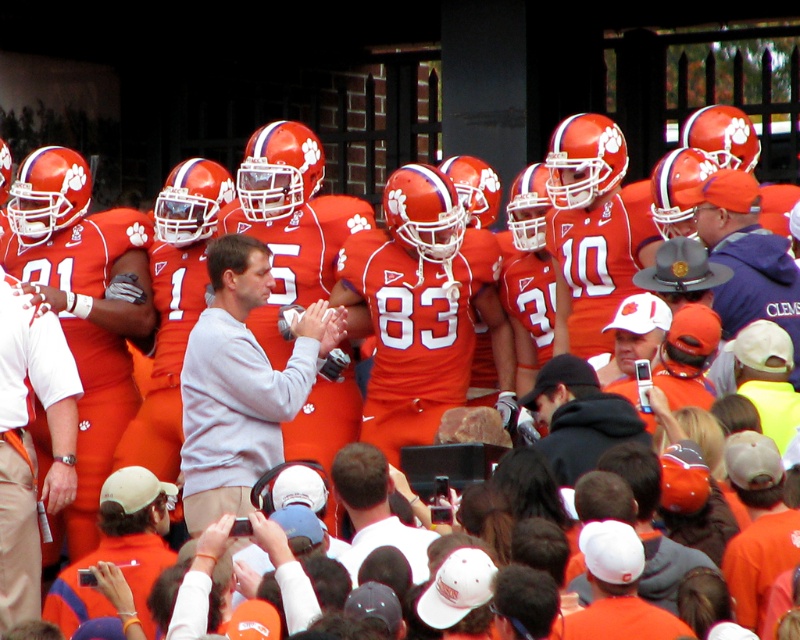
Between point (230, 378) and point (570, 376), which one is positioned behind?

The point (230, 378) is more distant.

Measure the distance between point (238, 468) and camera.

Point (238, 468) and camera are 59.45 meters apart.

At what (x,y) coordinates should I click in order to perform the action: click on gray sweatshirt at center. Please return your answer as a coordinate pair (x, y). Looking at the image, I should click on (x=241, y=381).

Can you confirm if orange jersey at lower left is positioned above white matte cap at center?

Incorrect, orange jersey at lower left is not positioned above white matte cap at center.

Can you confirm if orange jersey at lower left is shorter than white matte cap at center?

Indeed, orange jersey at lower left has a lesser height compared to white matte cap at center.

Which is behind, point (132, 509) or point (376, 476)?

Point (132, 509)

You are a GUI agent. You are given a task and a screenshot of the screen. Output one action in this format:
    pyautogui.click(x=<x>, y=<y>)
    Task: Click on the orange jersey at lower left
    The width and height of the screenshot is (800, 640).
    Given the screenshot: What is the action you would take?
    pyautogui.click(x=120, y=548)

Is orange jersey at lower left closer to the viewer compared to black hoodie at center?

That is True.

Which is more to the left, orange jersey at lower left or black hoodie at center?

Positioned to the left is orange jersey at lower left.

Does point (84, 602) come closer to viewer compared to point (556, 412)?

Yes, it is.

Locate an element on the screen. orange jersey at lower left is located at coordinates click(120, 548).